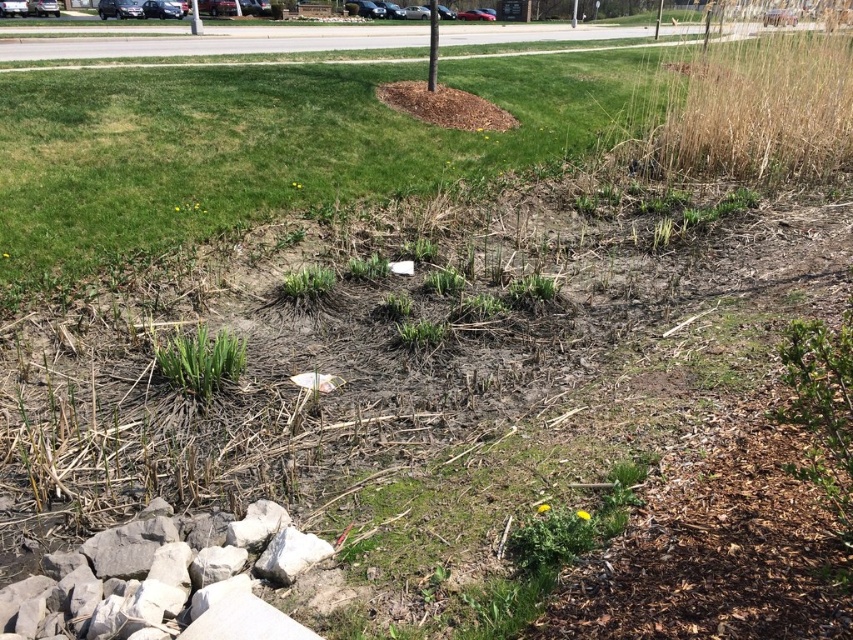
Is green grass at center closer to the viewer compared to smooth gray pole at center?

Yes, green grass at center is in front of smooth gray pole at center.

Which is in front, point (199, 330) or point (434, 70)?

Positioned in front is point (199, 330).

Is point (166, 365) farther from camera compared to point (432, 44)?

No, (166, 365) is in front of (432, 44).

Where is `green grass at center`? This screenshot has width=853, height=640. green grass at center is located at coordinates (201, 360).